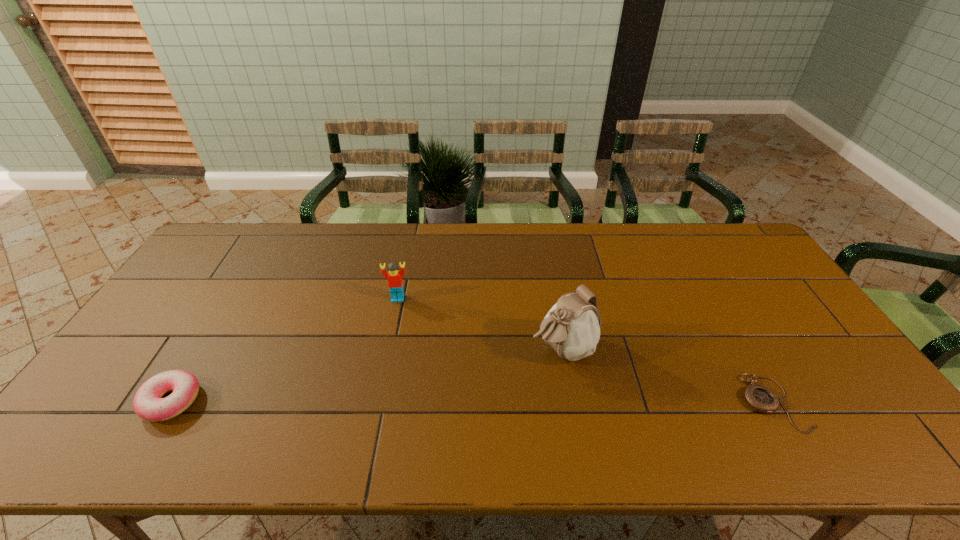
In order to click on vacant spot on the desktop that is between the third tallest object and the pocket watch and is positioned on the front-facing side of the second object from right to left in this screenshot , I will do `click(468, 402)`.

Identify the location of vacant spot on the desktop that is between the doughnut and the pocket watch and is positioned on the face of the farthest object. The width and height of the screenshot is (960, 540). (392, 402).